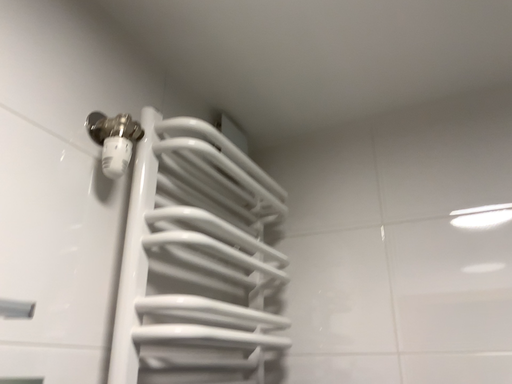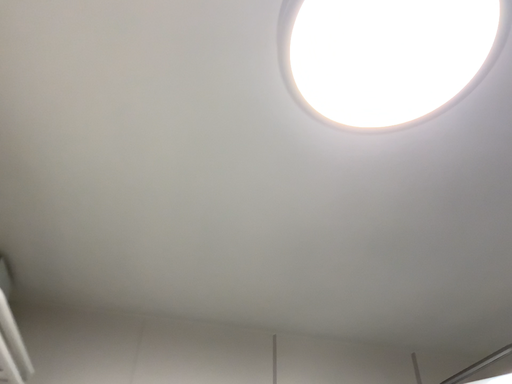
Question: How did the camera likely rotate when shooting the video?

Choices:
 (A) rotated upward
 (B) rotated downward

Answer: (A)